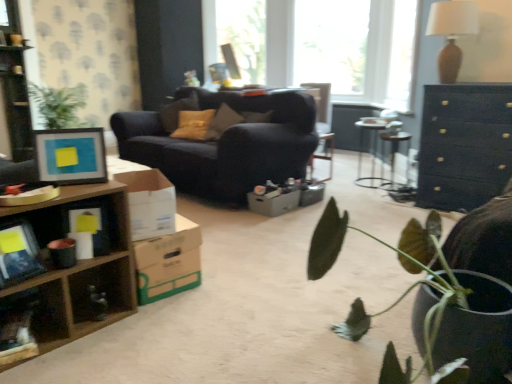
Question: Is white cardboard box at center, which is counted as the 1th cardboard box, starting from the left, facing towards cardboard box at lower left, which appears as the 2th cardboard box when viewed from the left?

Choices:
 (A) no
 (B) yes

Answer: (A)

Question: Does white cardboard box at center, marked as the third cardboard box in a back-to-front arrangement, have a greater width compared to cardboard box at lower left, which is the second cardboard box in back-to-front order?

Choices:
 (A) no
 (B) yes

Answer: (A)

Question: Is white cardboard box at center, marked as the third cardboard box in a back-to-front arrangement, located outside cardboard box at lower left, which is the second cardboard box in back-to-front order?

Choices:
 (A) yes
 (B) no

Answer: (A)

Question: From the image's perspective, is white cardboard box at center, the first cardboard box positioned from the front, located above cardboard box at lower left, which ranks as the second cardboard box in front-to-back order?

Choices:
 (A) no
 (B) yes

Answer: (B)

Question: Is white cardboard box at center, the first cardboard box positioned from the front, shorter than cardboard box at lower left, which appears as the 2th cardboard box when viewed from the left?

Choices:
 (A) no
 (B) yes

Answer: (B)

Question: Is brown textured lamp at upper right wider or thinner than white cardboard box at center, which is counted as the 1th cardboard box, starting from the left?

Choices:
 (A) wide
 (B) thin

Answer: (A)

Question: From the image's perspective, relative to white cardboard box at center, the first cardboard box positioned from the front, is brown textured lamp at upper right above or below?

Choices:
 (A) below
 (B) above

Answer: (B)

Question: Considering the positions of brown textured lamp at upper right and white cardboard box at center, marked as the third cardboard box in a back-to-front arrangement, in the image, is brown textured lamp at upper right bigger or smaller than white cardboard box at center, marked as the third cardboard box in a back-to-front arrangement,?

Choices:
 (A) big
 (B) small

Answer: (A)

Question: Do you think brown textured lamp at upper right is within white cardboard box at center, which is counted as the 1th cardboard box, starting from the left, or outside of it?

Choices:
 (A) outside
 (B) inside

Answer: (A)

Question: Considering the positions of dark wood dresser at upper right and cardboard box at lower left, which is counted as the second cardboard box, starting from the right, in the image, is dark wood dresser at upper right wider or thinner than cardboard box at lower left, which is counted as the second cardboard box, starting from the right,?

Choices:
 (A) thin
 (B) wide

Answer: (B)

Question: In the image, is dark wood dresser at upper right positioned in front of or behind cardboard box at lower left, which appears as the 2th cardboard box when viewed from the left?

Choices:
 (A) front
 (B) behind

Answer: (B)

Question: In terms of size, does dark wood dresser at upper right appear bigger or smaller than cardboard box at lower left, which appears as the 2th cardboard box when viewed from the left?

Choices:
 (A) big
 (B) small

Answer: (A)

Question: Is dark wood dresser at upper right inside the boundaries of cardboard box at lower left, which ranks as the second cardboard box in front-to-back order, or outside?

Choices:
 (A) outside
 (B) inside

Answer: (A)

Question: Considering their positions, is matte black picture frame at left located in front of or behind wooden shelf at lower left?

Choices:
 (A) front
 (B) behind

Answer: (B)

Question: From a real-world perspective, relative to wooden shelf at lower left, is matte black picture frame at left vertically above or below?

Choices:
 (A) above
 (B) below

Answer: (A)